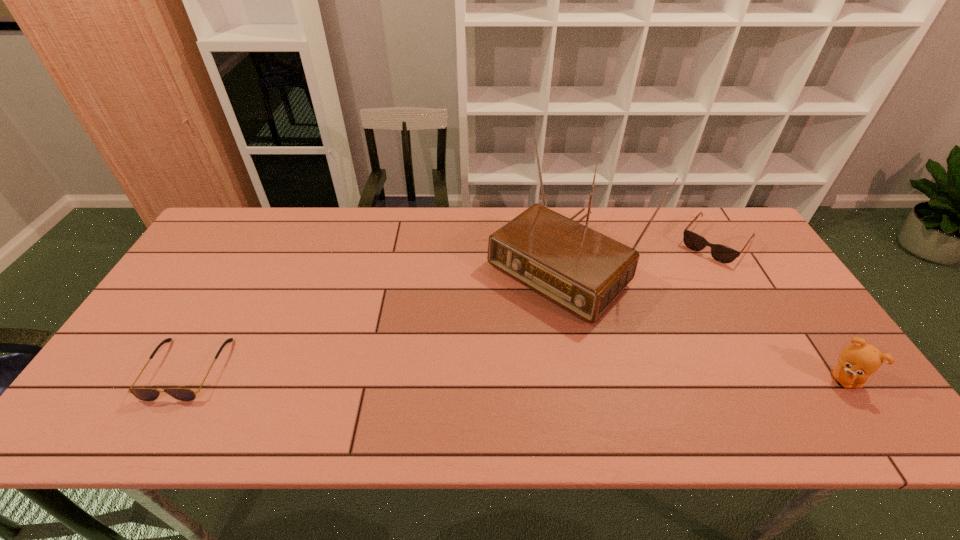
I want to click on the left sunglasses, so click(x=145, y=394).

Identify the location of the leftmost object. (145, 394).

Locate an element on the screen. teddy bear is located at coordinates (858, 361).

Locate an element on the screen. Image resolution: width=960 pixels, height=540 pixels. radio_receiver is located at coordinates (583, 271).

In order to click on the tallest object in this screenshot , I will do `click(583, 271)`.

Locate an element on the screen. the right sunglasses is located at coordinates 721,253.

The image size is (960, 540). I want to click on vacant area situated on the front panel of the radio_receiver, so click(x=430, y=384).

Where is `vacant point located on the front panel of the radio_receiver`? The width and height of the screenshot is (960, 540). vacant point located on the front panel of the radio_receiver is located at coordinates (481, 339).

The height and width of the screenshot is (540, 960). Identify the location of vacant region located 0.110m on the front panel of the radio_receiver. (489, 333).

At what (x,y) coordinates should I click in order to perform the action: click on vacant space located at the front lenses of the farther sunglasses. Please return your answer as a coordinate pair (x, y). This screenshot has height=540, width=960. Looking at the image, I should click on (681, 287).